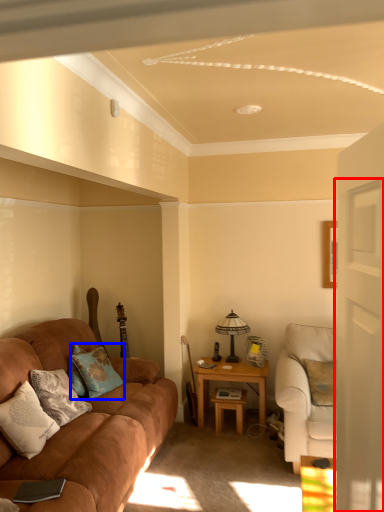
Question: Which point is further to the camera, glass door (highlighted by a red box) or pillow (highlighted by a blue box)?

Choices:
 (A) glass door
 (B) pillow

Answer: (B)